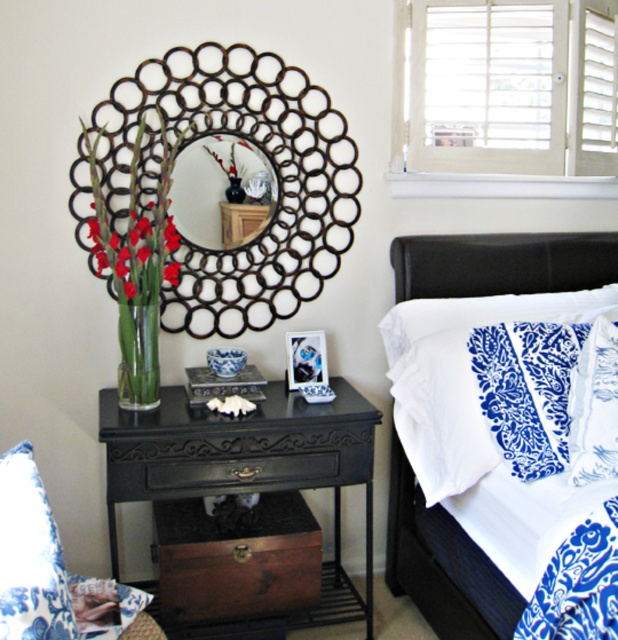
Question: Does blue printed fabric pillow at lower left have a larger size compared to metallic circular mirror at center?

Choices:
 (A) no
 (B) yes

Answer: (B)

Question: Which point is closer to the camera taking this photo?

Choices:
 (A) (208, 451)
 (B) (87, 579)
 (C) (153, 403)

Answer: (B)

Question: Which of these objects is positioned closest to the translucent glass vase at left?

Choices:
 (A) black wood side table at center
 (B) black wood dresser at lower left
 (C) white damask pillow at right
 (D) black glass vase at upper center

Answer: (A)

Question: Considering the real-world distances, which object is farthest from the white damask pillow at right?

Choices:
 (A) white damask fabric at center
 (B) black wood side table at center
 (C) rustic wood chest at lower center
 (D) black metal mirror at upper center

Answer: (C)

Question: Can you confirm if white damask fabric at center is smaller than black wood side table at center?

Choices:
 (A) no
 (B) yes

Answer: (A)

Question: Can you confirm if white damask fabric at center is positioned below rustic wood chest at lower center?

Choices:
 (A) yes
 (B) no

Answer: (B)